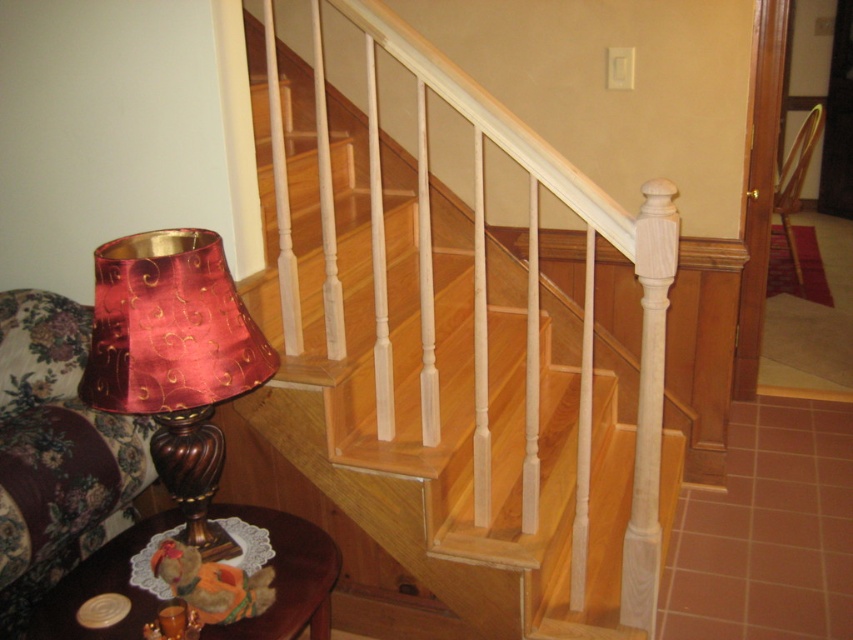
Is natural wood stairs at upper center above wooden armchair at center?

Incorrect, natural wood stairs at upper center is not positioned above wooden armchair at center.

Is natural wood stairs at upper center thinner than wooden armchair at center?

Incorrect, natural wood stairs at upper center's width is not less than wooden armchair at center's.

Find the location of `natural wood stairs at upper center`. natural wood stairs at upper center is located at coordinates (457, 358).

Find the location of a particular element. This screenshot has height=640, width=853. natural wood stairs at upper center is located at coordinates (457, 358).

Which is in front, point (392, 440) or point (119, 355)?

Point (119, 355) is in front.

Which of these two, natural wood stairs at upper center or satin burgundy lampshade at left, stands taller?

Standing taller between the two is natural wood stairs at upper center.

Is point (467, 408) closer to camera compared to point (204, 438)?

No, (467, 408) is further to viewer.

In order to click on natural wood stairs at upper center in this screenshot , I will do `click(457, 358)`.

Who is more forward, (325, 602) or (775, 212)?

Positioned in front is point (325, 602).

Can you confirm if brown wooden stool at lower left is taller than wooden armchair at center?

Incorrect, brown wooden stool at lower left's height is not larger of wooden armchair at center's.

Is point (303, 625) positioned behind point (795, 166)?

That is False.

The image size is (853, 640). In order to click on brown wooden stool at lower left in this screenshot , I will do `click(287, 577)`.